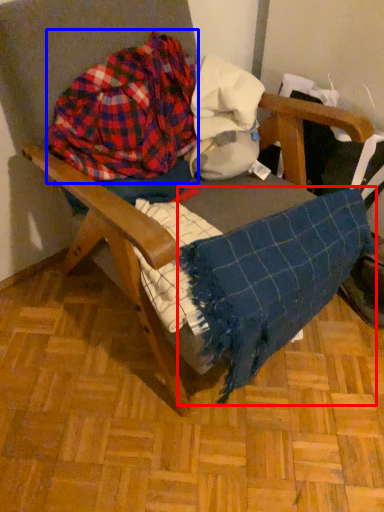
Question: Among these objects, which one is farthest to the camera, blanket (highlighted by a red box) or flannel (highlighted by a blue box)?

Choices:
 (A) blanket
 (B) flannel

Answer: (B)